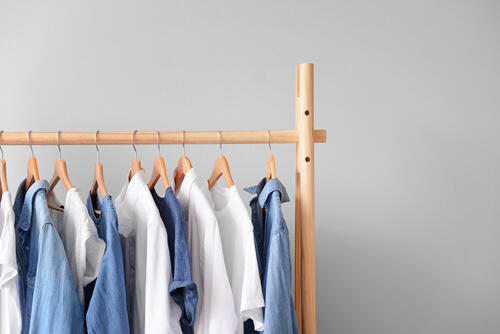
You are a GUI agent. You are given a task and a screenshot of the screen. Output one action in this format:
    pyautogui.click(x=<x>, y=<y>)
    Task: Click on the hangers
    Image resolution: width=500 pixels, height=334 pixels.
    Given the screenshot: What is the action you would take?
    pyautogui.click(x=6, y=182), pyautogui.click(x=36, y=176), pyautogui.click(x=58, y=173), pyautogui.click(x=98, y=173), pyautogui.click(x=135, y=166), pyautogui.click(x=156, y=165), pyautogui.click(x=180, y=162), pyautogui.click(x=226, y=167), pyautogui.click(x=274, y=173)